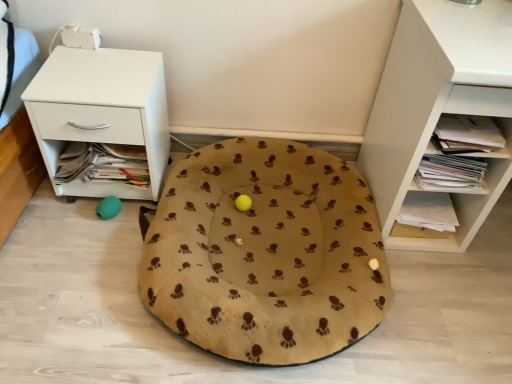
Question: Is white matte shelf at right positioned in front of white glossy nightstand at left?

Choices:
 (A) yes
 (B) no

Answer: (A)

Question: Does white matte shelf at right have a greater height compared to white glossy nightstand at left?

Choices:
 (A) yes
 (B) no

Answer: (A)

Question: Is white matte shelf at right shorter than white glossy nightstand at left?

Choices:
 (A) yes
 (B) no

Answer: (B)

Question: Is white matte shelf at right thinner than white glossy nightstand at left?

Choices:
 (A) yes
 (B) no

Answer: (B)

Question: Considering the relative sizes of white matte shelf at right and white glossy nightstand at left in the image provided, is white matte shelf at right bigger than white glossy nightstand at left?

Choices:
 (A) yes
 (B) no

Answer: (A)

Question: Is white matte shelf at right facing away from white glossy nightstand at left?

Choices:
 (A) no
 (B) yes

Answer: (A)

Question: Does white glossy nightstand at left have a lesser height compared to beige fabric dog bed at center?

Choices:
 (A) yes
 (B) no

Answer: (B)

Question: Is white glossy nightstand at left to the left of beige fabric dog bed at center from the viewer's perspective?

Choices:
 (A) yes
 (B) no

Answer: (A)

Question: Considering the relative sizes of white glossy nightstand at left and beige fabric dog bed at center in the image provided, is white glossy nightstand at left taller than beige fabric dog bed at center?

Choices:
 (A) yes
 (B) no

Answer: (A)

Question: Can you confirm if white glossy nightstand at left is smaller than beige fabric dog bed at center?

Choices:
 (A) no
 (B) yes

Answer: (B)

Question: Is white glossy nightstand at left in front of beige fabric dog bed at center?

Choices:
 (A) yes
 (B) no

Answer: (B)

Question: From a real-world perspective, is white glossy nightstand at left positioned over beige fabric dog bed at center based on gravity?

Choices:
 (A) yes
 (B) no

Answer: (A)

Question: Are white glossy nightstand at left and white matte shelf at right beside each other?

Choices:
 (A) no
 (B) yes

Answer: (A)